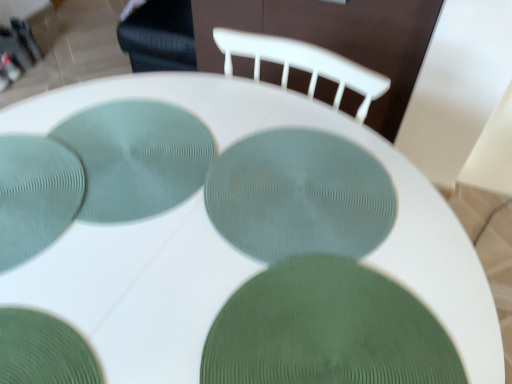
Question: Can you confirm if green textured plate at center, marked as the 1th glass plate in a right-to-left arrangement, is thinner than teal textured placemat at center, which ranks as the third glass plate in right-to-left order?

Choices:
 (A) no
 (B) yes

Answer: (A)

Question: Does green textured plate at center, marked as the 1th glass plate in a right-to-left arrangement, turn towards teal textured placemat at center, which ranks as the third glass plate in right-to-left order?

Choices:
 (A) no
 (B) yes

Answer: (A)

Question: Can you confirm if green textured plate at center, the 5th glass plate positioned from the left, is shorter than teal textured placemat at center, which ranks as the third glass plate in right-to-left order?

Choices:
 (A) no
 (B) yes

Answer: (B)

Question: Is green textured plate at center, marked as the 1th glass plate in a right-to-left arrangement, in contact with teal textured placemat at center, the third glass plate viewed from the left?

Choices:
 (A) yes
 (B) no

Answer: (B)

Question: Is green textured plate at center, marked as the 1th glass plate in a right-to-left arrangement, spatially inside matte green plate at center, placed as the second glass plate when sorted from right to left, or outside of it?

Choices:
 (A) outside
 (B) inside

Answer: (A)

Question: Looking at their shapes, would you say green textured plate at center, the 5th glass plate positioned from the left, is wider or thinner than matte green plate at center, acting as the fourth glass plate starting from the left?

Choices:
 (A) thin
 (B) wide

Answer: (B)

Question: Is point (247, 339) positioned closer to the camera than point (349, 201)?

Choices:
 (A) farther
 (B) closer

Answer: (B)

Question: Looking at the image, does green textured plate at center, marked as the 1th glass plate in a right-to-left arrangement, seem bigger or smaller compared to matte green plate at center, acting as the fourth glass plate starting from the left?

Choices:
 (A) big
 (B) small

Answer: (A)

Question: Is matte green plate at center, acting as the fourth glass plate starting from the left, situated inside matte green plate at lower left, which is the first glass plate in left-to-right order, or outside?

Choices:
 (A) inside
 (B) outside

Answer: (B)

Question: Considering the positions of matte green plate at center, placed as the second glass plate when sorted from right to left, and matte green plate at lower left, which is the first glass plate in left-to-right order, in the image, is matte green plate at center, placed as the second glass plate when sorted from right to left, taller or shorter than matte green plate at lower left, which is the first glass plate in left-to-right order,?

Choices:
 (A) tall
 (B) short

Answer: (B)

Question: In terms of size, does matte green plate at center, placed as the second glass plate when sorted from right to left, appear bigger or smaller than matte green plate at lower left, marked as the 5th glass plate in a right-to-left arrangement?

Choices:
 (A) small
 (B) big

Answer: (A)

Question: In the image, is matte green plate at center, placed as the second glass plate when sorted from right to left, on the left side or the right side of matte green plate at lower left, marked as the 5th glass plate in a right-to-left arrangement?

Choices:
 (A) right
 (B) left

Answer: (A)

Question: In the image, is matte green plate at center, acting as the fourth glass plate starting from the left, on the left side or the right side of green textured glass plate at lower left, the fourth glass plate viewed from the right?

Choices:
 (A) right
 (B) left

Answer: (A)

Question: Would you say matte green plate at center, placed as the second glass plate when sorted from right to left, is inside or outside green textured glass plate at lower left, which ranks as the second glass plate in left-to-right order?

Choices:
 (A) inside
 (B) outside

Answer: (B)